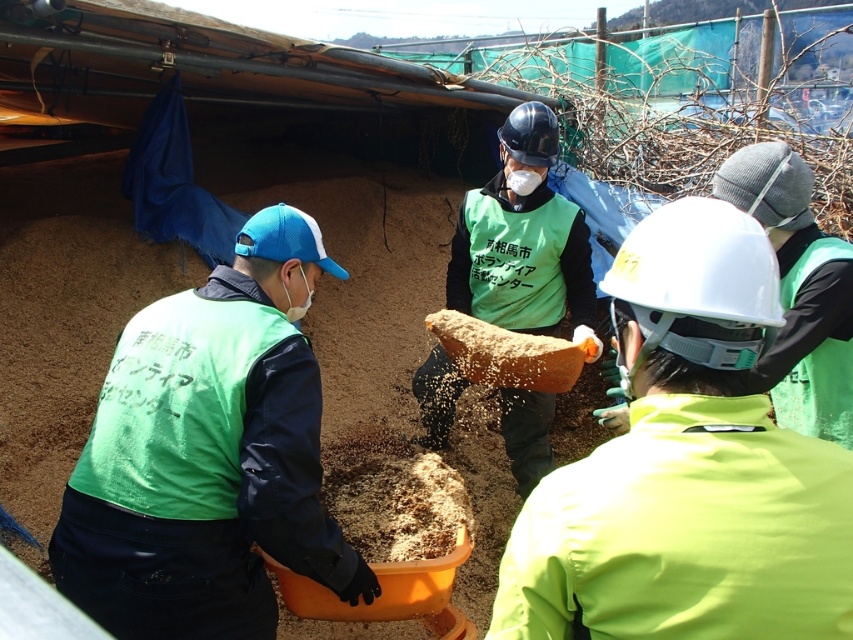
Question: Considering the real-world distances, which object is closest to the green fabric vest at center?

Choices:
 (A) matte green vest at center
 (B) green fabric vest at left

Answer: (B)

Question: Can you confirm if matte green vest at center is positioned below green fabric vest at left?

Choices:
 (A) yes
 (B) no

Answer: (B)

Question: Estimate the real-world distances between objects in this image. Which object is closer to the matte green vest at center?

Choices:
 (A) green fabric vest at left
 (B) green fabric vest at center

Answer: (A)

Question: In this image, where is matte green vest at center located relative to green fabric vest at left?

Choices:
 (A) above
 (B) below

Answer: (A)

Question: Among these objects, which one is nearest to the camera?

Choices:
 (A) matte green vest at center
 (B) green fabric vest at left
 (C) green fabric vest at center

Answer: (A)

Question: Is green fabric vest at left below green fabric vest at center?

Choices:
 (A) no
 (B) yes

Answer: (B)